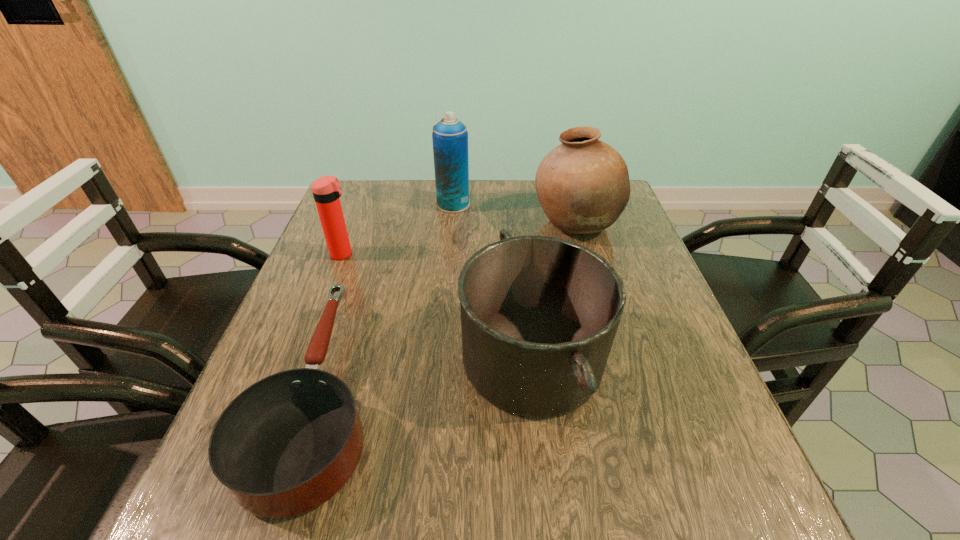
Where is `vacant space that is in between the thermos bottle and the pan`? This screenshot has width=960, height=540. vacant space that is in between the thermos bottle and the pan is located at coordinates (438, 306).

Locate an element on the screen. Image resolution: width=960 pixels, height=540 pixels. unoccupied position between the thermos bottle and the aerosol can is located at coordinates (398, 229).

Select which object appears as the closest to the pan. Please provide its 2D coordinates. Your answer should be formatted as a tuple, i.e. [(x, y)], where the tuple contains the x and y coordinates of a point satisfying the conditions above.

[(539, 314)]

Select which object is the second closest to the pan. Please provide its 2D coordinates. Your answer should be formatted as a tuple, i.e. [(x, y)], where the tuple contains the x and y coordinates of a point satisfying the conditions above.

[(583, 186)]

The image size is (960, 540). In order to click on vacant region that satisfies the following two spatial constraints: 1. on the back side of the pan; 2. on the right side of the pottery in this screenshot , I will do `click(516, 223)`.

You are a GUI agent. You are given a task and a screenshot of the screen. Output one action in this format:
    pyautogui.click(x=<x>, y=<y>)
    Task: Click on the blank space that satisfies the following two spatial constraints: 1. on the front side of the pottery; 2. on the right side of the aerosol can
    The width and height of the screenshot is (960, 540).
    Given the screenshot: What is the action you would take?
    pyautogui.click(x=451, y=223)

You are a GUI agent. You are given a task and a screenshot of the screen. Output one action in this format:
    pyautogui.click(x=<x>, y=<y>)
    Task: Click on the blank area in the image that satisfies the following two spatial constraints: 1. on the handle side of the pottery; 2. on the right side of the pan
    The height and width of the screenshot is (540, 960).
    Given the screenshot: What is the action you would take?
    pyautogui.click(x=374, y=223)

The width and height of the screenshot is (960, 540). I want to click on vacant region that satisfies the following two spatial constraints: 1. on the handle side of the pottery; 2. on the right side of the pan, so click(x=374, y=223).